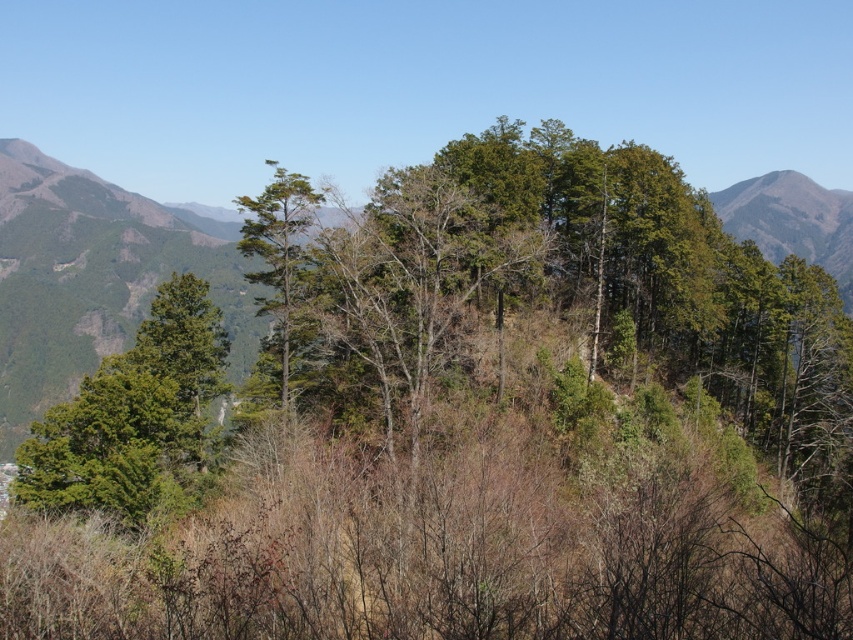
Based on the scene description, where are the green leafy trees at upper left located in terms of their 2D coordinates?

The green leafy trees at upper left are located at 2D coordinates point [96,278].

You are standing at the center of the image and want to locate the green matte tree at left. Which direction should you look to find it?

The green matte tree at left is located at the left side of the image, so you should look to your left to find it.